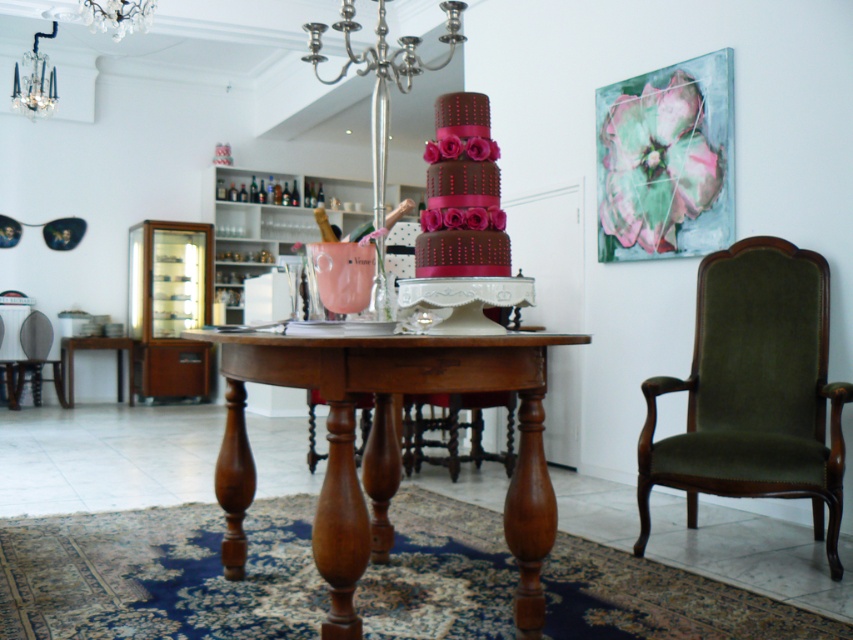
You are standing at the entrance of the dining area and want to sit down. There is a velvet green armchair at right. Based on its position, can you estimate how far it is from the entrance?

The velvet green armchair at right is located at coordinates point (x=753, y=390), which suggests it is positioned near the right side of the room, approximately 61.1 cm from the left edge and 88.4 cm from the bottom edge. However, without knowing the exact dimensions of the room or the entrance location, it is difficult to provide an accurate distance from the entrance.

You are sitting in the velvet green armchair at left and want to reach the wooden table at lower left to grab a napkin. Is the table within easy reach from your current position?

The velvet green armchair at left is closer to the viewer than the wooden table at lower left, so the table is further away. You may need to get up to reach it easily.